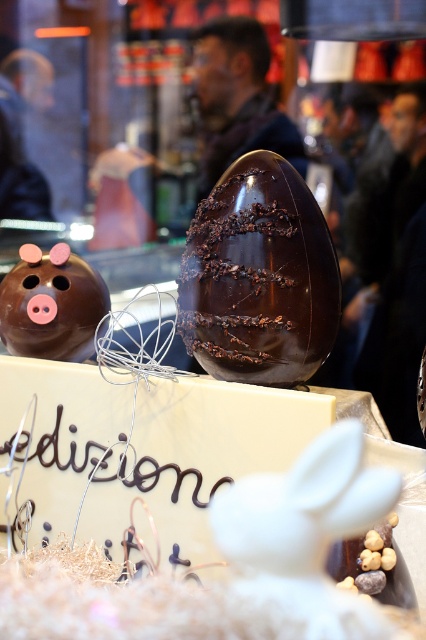
Between chocolateshinyegg at center and matte chocolate piggy bank at left, which one is positioned lower?

Positioned lower is matte chocolate piggy bank at left.

Can you confirm if chocolateshinyegg at center is wider than matte chocolate piggy bank at left?

Yes.

Is point (264, 259) positioned after point (85, 294)?

No.

Image resolution: width=426 pixels, height=640 pixels. I want to click on chocolateshinyegg at center, so click(259, 276).